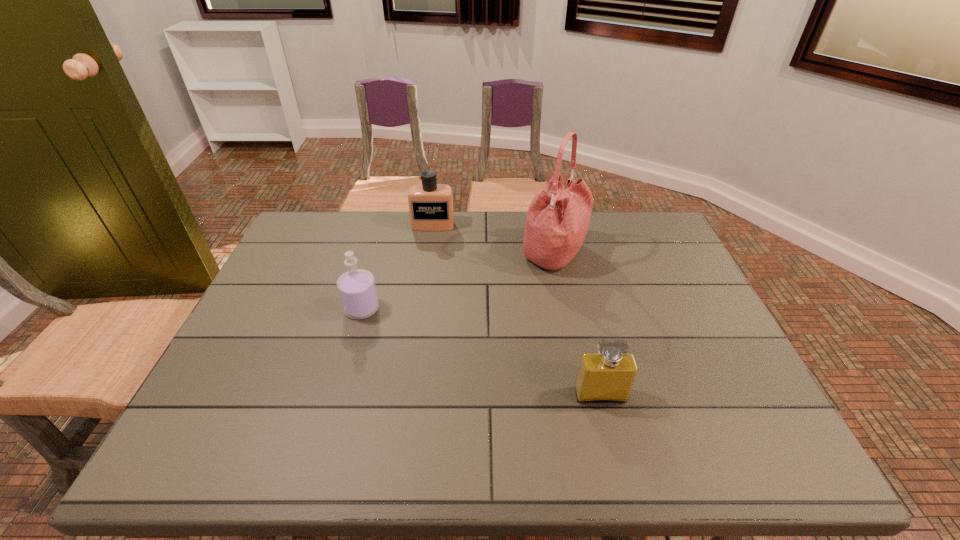
Find the location of a particular element. The image size is (960, 540). vacant space at the near right corner is located at coordinates (728, 427).

Image resolution: width=960 pixels, height=540 pixels. What are the coordinates of `vacant area that lies between the handbag and the farthest object` in the screenshot? It's located at (493, 240).

At what (x,y) coordinates should I click in order to perform the action: click on empty space between the leftmost perfume and the farthest object. Please return your answer as a coordinate pair (x, y). This screenshot has width=960, height=540. Looking at the image, I should click on (397, 267).

Where is `blank region between the leftmost object and the handbag`? This screenshot has width=960, height=540. blank region between the leftmost object and the handbag is located at coordinates (458, 281).

Find the location of a particular element. Image resolution: width=960 pixels, height=540 pixels. vacant region between the farthest object and the nearest perfume is located at coordinates (516, 310).

At what (x,y) coordinates should I click in order to perform the action: click on unoccupied position between the rightmost perfume and the second nearest object. Please return your answer as a coordinate pair (x, y). The width and height of the screenshot is (960, 540). Looking at the image, I should click on (481, 352).

Identify the location of vacant point located between the farthest object and the nearest perfume. The width and height of the screenshot is (960, 540). (516, 310).

The height and width of the screenshot is (540, 960). Find the location of `vacant point located between the third nearest object and the nearest object`. vacant point located between the third nearest object and the nearest object is located at coordinates (578, 324).

In order to click on free space between the nearest object and the tallest object in this screenshot , I will do (578, 324).

Find the location of a particular element. unoccupied area between the second object from left to right and the third nearest object is located at coordinates (493, 240).